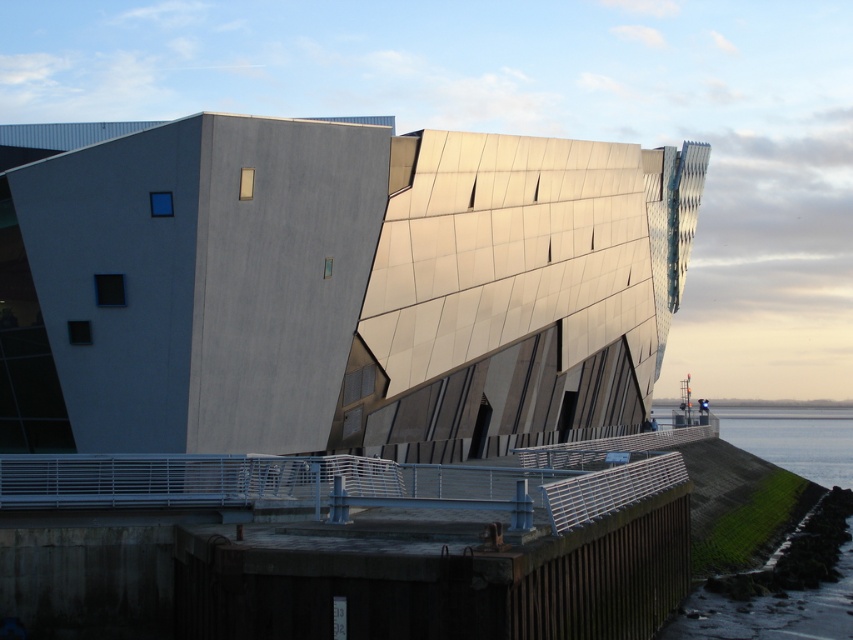
You are standing at the water edge and want to reach the concrete dock at lower center. What are the coordinates to locate it?

The concrete dock at lower center is located at coordinates point (x=347, y=550).